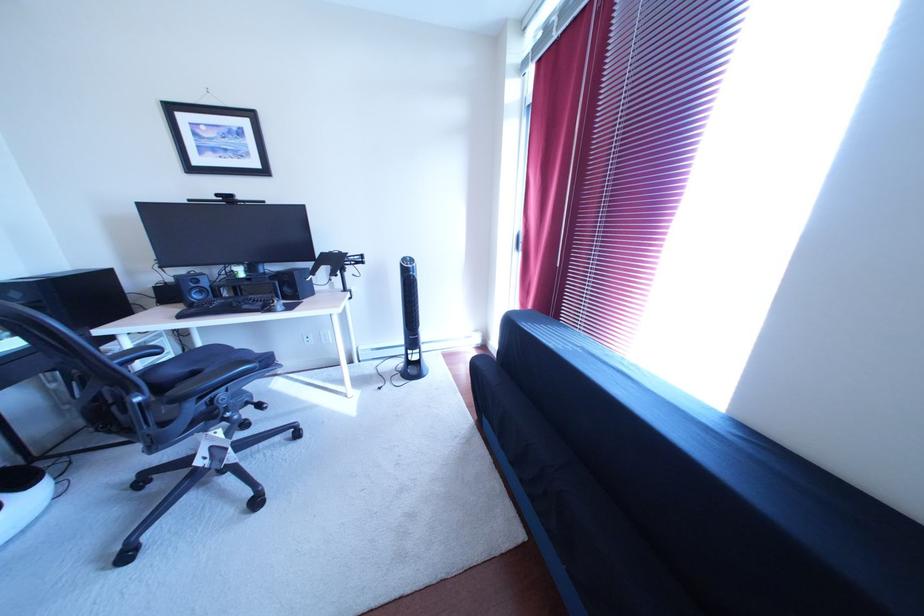
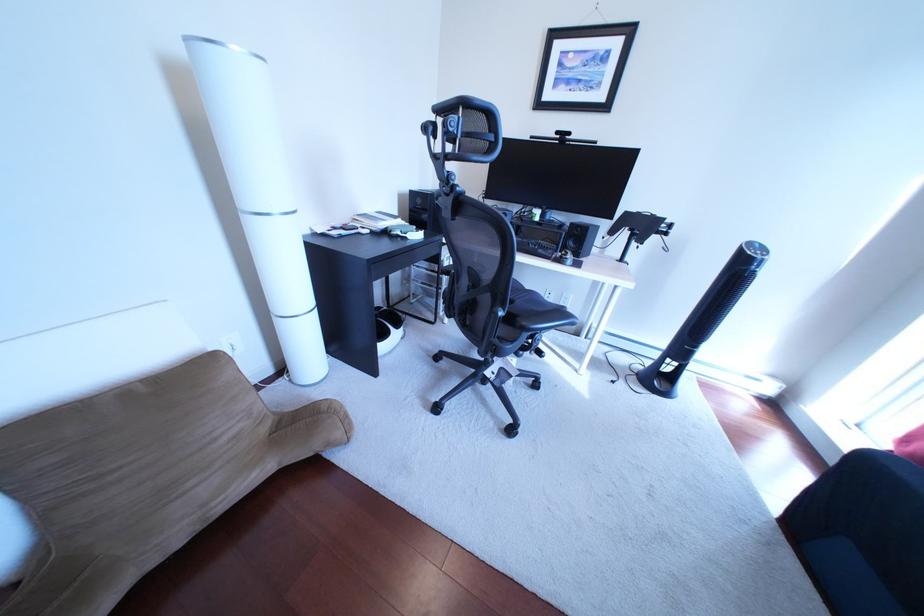
Question: The images are taken continuously from a first-person perspective. In which direction is your viewpoint rotating?

Choices:
 (A) Left
 (B) Right
 (C) Up
 (D) Down

Answer: (A)